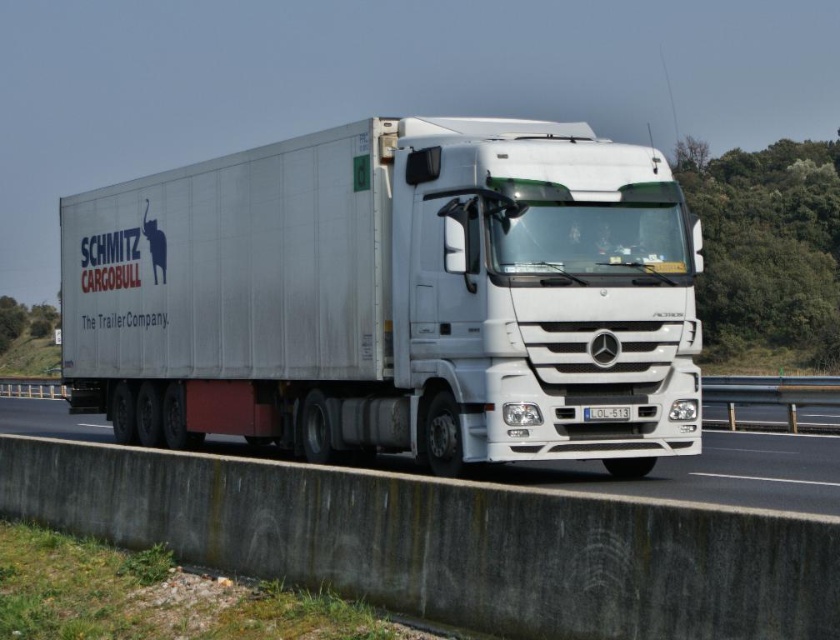
Question: Is white metallic trailer truck at center to the left of white glossy concrete barrier at lower center from the viewer's perspective?

Choices:
 (A) yes
 (B) no

Answer: (B)

Question: Can you confirm if white metallic trailer truck at center is positioned below white glossy concrete barrier at lower center?

Choices:
 (A) no
 (B) yes

Answer: (A)

Question: From the image, what is the correct spatial relationship of white metallic trailer truck at center in relation to white glossy concrete barrier at lower center?

Choices:
 (A) right
 (B) left

Answer: (A)

Question: Which object appears closest to the camera in this image?

Choices:
 (A) white metallic trailer truck at center
 (B) white glossy concrete barrier at lower center

Answer: (B)